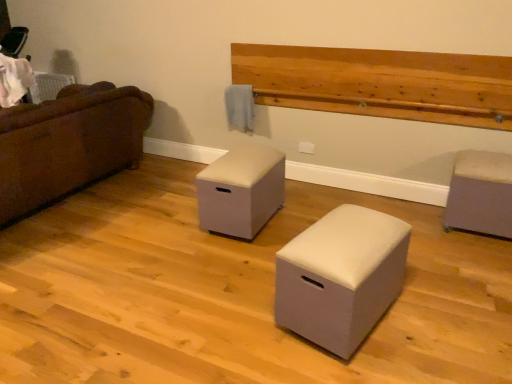
Question: Would you say beige fabric ottoman at center, which is the 3th furniture from right to left, contains matte gray ottoman at right, which appears as the 3th furniture when viewed from the left?

Choices:
 (A) yes
 (B) no

Answer: (B)

Question: Is beige fabric ottoman at center, which is the 3th furniture from right to left, not inside matte gray ottoman at right, which appears as the 3th furniture when viewed from the left?

Choices:
 (A) no
 (B) yes

Answer: (B)

Question: From the image's perspective, does beige fabric ottoman at center, which is counted as the 1th furniture, starting from the left, appear lower than matte gray ottoman at right, the first furniture when ordered from right to left?

Choices:
 (A) yes
 (B) no

Answer: (B)

Question: Is beige fabric ottoman at center, which is the 3th furniture from right to left, oriented towards matte gray ottoman at right, the first furniture when ordered from right to left?

Choices:
 (A) yes
 (B) no

Answer: (B)

Question: Is the position of beige fabric ottoman at center, which is the 3th furniture from right to left, less distant than that of matte gray ottoman at right, the first furniture when ordered from right to left?

Choices:
 (A) no
 (B) yes

Answer: (B)

Question: From a real-world perspective, is beige fabric ottoman at center, which is counted as the 1th furniture, starting from the left, under matte gray ottoman at right, the first furniture when ordered from right to left?

Choices:
 (A) yes
 (B) no

Answer: (A)

Question: Would you say beige fabric ottoman at center, which is counted as the 1th furniture, starting from the left, is outside brown fabric couch at left?

Choices:
 (A) yes
 (B) no

Answer: (A)

Question: Considering the relative sizes of beige fabric ottoman at center, which is the 3th furniture from right to left, and brown fabric couch at left in the image provided, is beige fabric ottoman at center, which is the 3th furniture from right to left, wider than brown fabric couch at left?

Choices:
 (A) no
 (B) yes

Answer: (A)

Question: Considering the relative sizes of beige fabric ottoman at center, which is counted as the 1th furniture, starting from the left, and brown fabric couch at left in the image provided, is beige fabric ottoman at center, which is counted as the 1th furniture, starting from the left, shorter than brown fabric couch at left?

Choices:
 (A) no
 (B) yes

Answer: (B)

Question: Can you confirm if beige fabric ottoman at center, which is the 3th furniture from right to left, is positioned to the right of brown fabric couch at left?

Choices:
 (A) no
 (B) yes

Answer: (B)

Question: Is beige fabric ottoman at center, which is counted as the 1th furniture, starting from the left, bigger than brown fabric couch at left?

Choices:
 (A) yes
 (B) no

Answer: (B)

Question: Can you confirm if white fabric ottoman at center, which is the 2th furniture in right-to-left order, is thinner than natural wood plank at upper center?

Choices:
 (A) yes
 (B) no

Answer: (B)